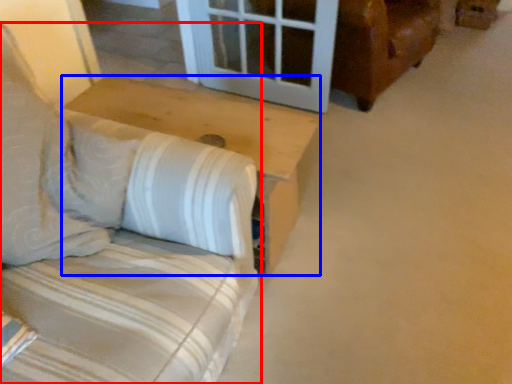
Question: Which object is closer to the camera taking this photo, furniture (highlighted by a red box) or table (highlighted by a blue box)?

Choices:
 (A) furniture
 (B) table

Answer: (A)